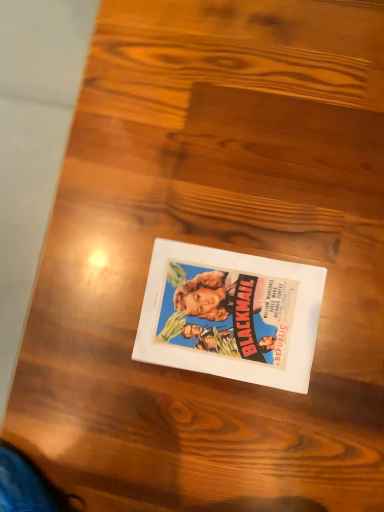
The width and height of the screenshot is (384, 512). I want to click on free space above matte paper book at center (from a real-world perspective), so click(227, 308).